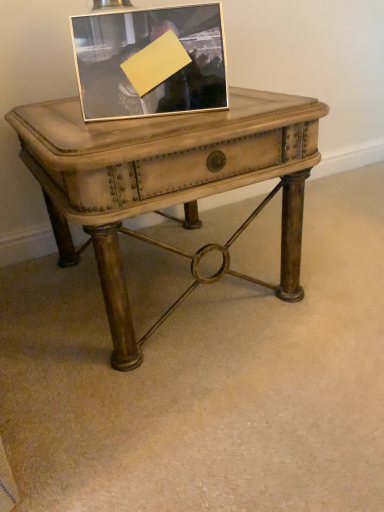
The image size is (384, 512). What are the coordinates of `silver metallic picture frame at upper center` in the screenshot? It's located at (150, 61).

What is the approximate width of silver metallic picture frame at upper center?

silver metallic picture frame at upper center is 7.41 inches in width.

The width and height of the screenshot is (384, 512). Describe the element at coordinates (150, 61) in the screenshot. I see `silver metallic picture frame at upper center` at that location.

This screenshot has width=384, height=512. Describe the element at coordinates (166, 180) in the screenshot. I see `matte wood table at center` at that location.

Image resolution: width=384 pixels, height=512 pixels. What are the coordinates of `matte wood table at center` in the screenshot? It's located at (166, 180).

This screenshot has height=512, width=384. In order to click on silver metallic picture frame at upper center in this screenshot , I will do `click(150, 61)`.

Visually, is matte wood table at center positioned to the left or to the right of silver metallic picture frame at upper center?

matte wood table at center is positioned on silver metallic picture frame at upper center's right side.

Between matte wood table at center and silver metallic picture frame at upper center, which one is positioned in front?

Positioned in front is matte wood table at center.

Between point (81, 170) and point (80, 67), which one is positioned behind?

The point (80, 67) is behind.

From the image's perspective, is matte wood table at center beneath silver metallic picture frame at upper center?

Yes, from the image's perspective, matte wood table at center is beneath silver metallic picture frame at upper center.

From a real-world perspective, which is physically above, matte wood table at center or silver metallic picture frame at upper center?

silver metallic picture frame at upper center.

In the scene shown: Considering the sizes of objects matte wood table at center and silver metallic picture frame at upper center in the image provided, who is wider, matte wood table at center or silver metallic picture frame at upper center?

With larger width is matte wood table at center.

Is matte wood table at center taller or shorter than silver metallic picture frame at upper center?

Considering their sizes, matte wood table at center has more height than silver metallic picture frame at upper center.

Based on their sizes in the image, would you say matte wood table at center is bigger or smaller than silver metallic picture frame at upper center?

In the image, matte wood table at center appears to be larger than silver metallic picture frame at upper center.

Would you say matte wood table at center is outside silver metallic picture frame at upper center?

Yes.

Would you consider matte wood table at center to be distant from silver metallic picture frame at upper center?

Actually, matte wood table at center and silver metallic picture frame at upper center are a little close together.

Could you tell me if matte wood table at center is facing silver metallic picture frame at upper center?

No, matte wood table at center is not turned towards silver metallic picture frame at upper center.

How different are the orientations of matte wood table at center and silver metallic picture frame at upper center in degrees?

The angle between the facing direction of matte wood table at center and the facing direction of silver metallic picture frame at upper center is 25.8 degrees.

Identify the location of picture frame behind the matte wood table at center. (150, 61).

Considering the relative positions of silver metallic picture frame at upper center and matte wood table at center in the image provided, is silver metallic picture frame at upper center to the left of matte wood table at center from the viewer's perspective?

Yes.

Who is more distant, silver metallic picture frame at upper center or matte wood table at center?

silver metallic picture frame at upper center is further from the camera.

Does point (166, 37) come in front of point (249, 142)?

No, it is behind (249, 142).

From the image's perspective, is silver metallic picture frame at upper center positioned above or below matte wood table at center?

silver metallic picture frame at upper center is situated higher than matte wood table at center in the image.

From a real-world perspective, between silver metallic picture frame at upper center and matte wood table at center, who is vertically lower?

In real-world perspective, matte wood table at center is lower.

Which of these two, silver metallic picture frame at upper center or matte wood table at center, is thinner?

silver metallic picture frame at upper center is thinner.

Does silver metallic picture frame at upper center have a greater height compared to matte wood table at center?

No.

From the picture: Does silver metallic picture frame at upper center have a larger size compared to matte wood table at center?

No.

Is silver metallic picture frame at upper center situated inside matte wood table at center or outside?

silver metallic picture frame at upper center lies outside matte wood table at center.

Is silver metallic picture frame at upper center next to matte wood table at center and touching it?

silver metallic picture frame at upper center is not next to matte wood table at center, and they're not touching.

Is matte wood table at center at the back of silver metallic picture frame at upper center?

No, silver metallic picture frame at upper center's orientation is not away from matte wood table at center.

At what (x,y) coordinates should I click in order to perform the action: click on table in front of the silver metallic picture frame at upper center. Please return your answer as a coordinate pair (x, y). The image size is (384, 512). Looking at the image, I should click on (166, 180).

Find the location of a particular element. This screenshot has height=512, width=384. picture frame behind the matte wood table at center is located at coordinates (150, 61).

The image size is (384, 512). Identify the location of picture frame located above the matte wood table at center (from the image's perspective). pyautogui.click(x=150, y=61).